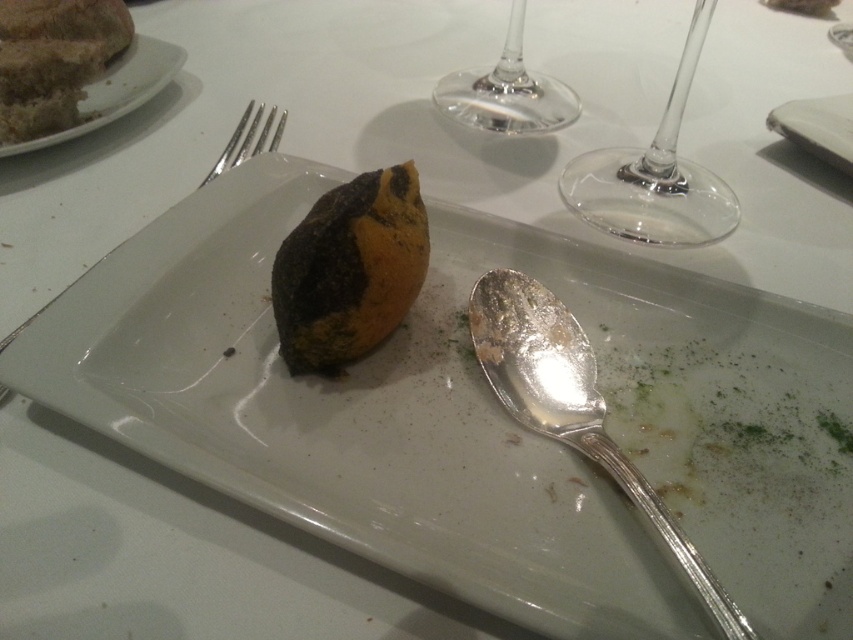
Question: Which point appears farthest from the camera in this image?

Choices:
 (A) (421, 241)
 (B) (822, 116)
 (C) (454, 108)
 (D) (231, 141)

Answer: (B)

Question: Considering the real-world distances, which object is closest to the white matte plate at upper right?

Choices:
 (A) transparent glass wine glass at upper right
 (B) transparent glass wine glass at upper center
 (C) brown matte bread at upper left

Answer: (A)

Question: Among these objects, which one is nearest to the camera?

Choices:
 (A) transparent glass wine glass at upper center
 (B) white matte plate at upper right

Answer: (B)

Question: Where is transparent glass wine glass at upper right located in relation to transparent glass wine glass at upper center in the image?

Choices:
 (A) right
 (B) left

Answer: (A)

Question: Observing the image, what is the correct spatial positioning of white matte plate at upper right in reference to silver metallic fork at upper left?

Choices:
 (A) left
 (B) right

Answer: (B)

Question: Does rotten orange at center have a larger size compared to transparent glass wine glass at upper right?

Choices:
 (A) yes
 (B) no

Answer: (B)